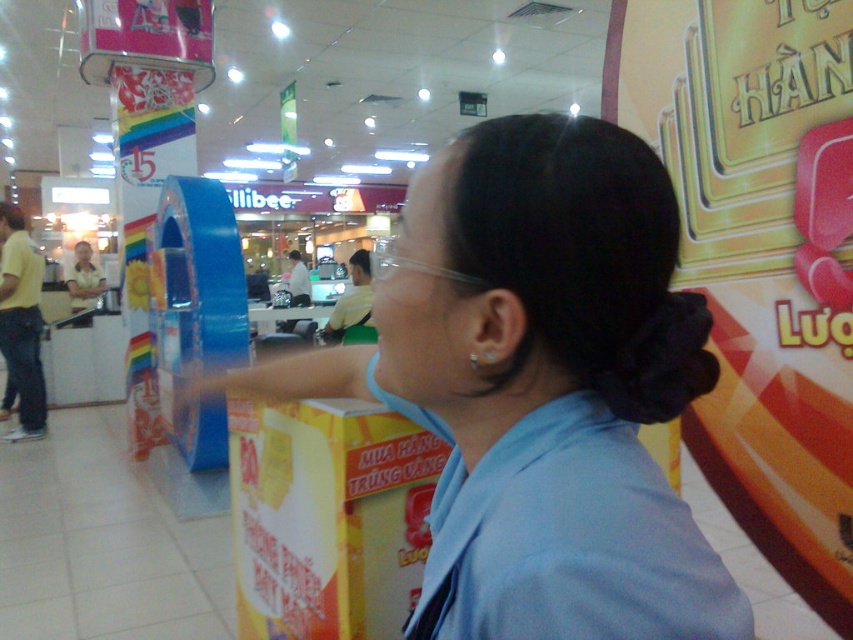
Question: Does blue fabric shirt at center have a smaller size compared to transparent plastic glasses at center?

Choices:
 (A) no
 (B) yes

Answer: (B)

Question: Which point is farther from the camera taking this photo?

Choices:
 (A) (460, 413)
 (B) (451, 278)

Answer: (A)

Question: Does blue fabric shirt at center come behind transparent plastic glasses at center?

Choices:
 (A) yes
 (B) no

Answer: (B)

Question: Among these points, which one is farthest from the camera?

Choices:
 (A) (596, 170)
 (B) (383, 262)

Answer: (B)

Question: Is blue fabric shirt at center bigger than transparent plastic glasses at center?

Choices:
 (A) no
 (B) yes

Answer: (A)